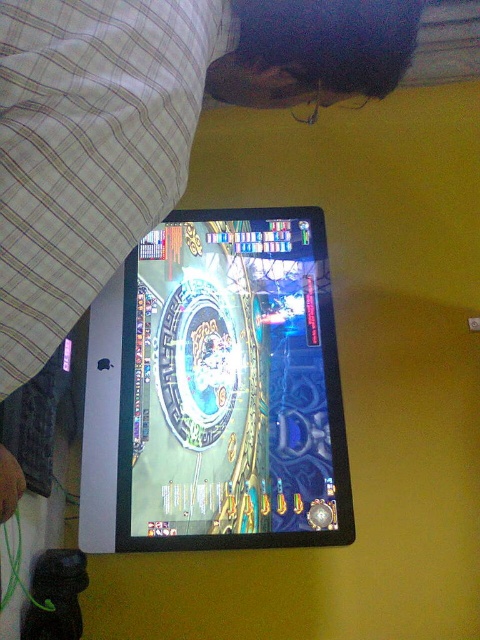
What do you see at coordinates (144, 124) in the screenshot? I see `matte black tablet at center` at bounding box center [144, 124].

Between matte black tablet at center and glossy plastic tablet at center, which one has less height?

Standing shorter between the two is matte black tablet at center.

Is point (29, 168) positioned in front of point (228, 374)?

Yes.

The image size is (480, 640). Identify the location of matte black tablet at center. (144, 124).